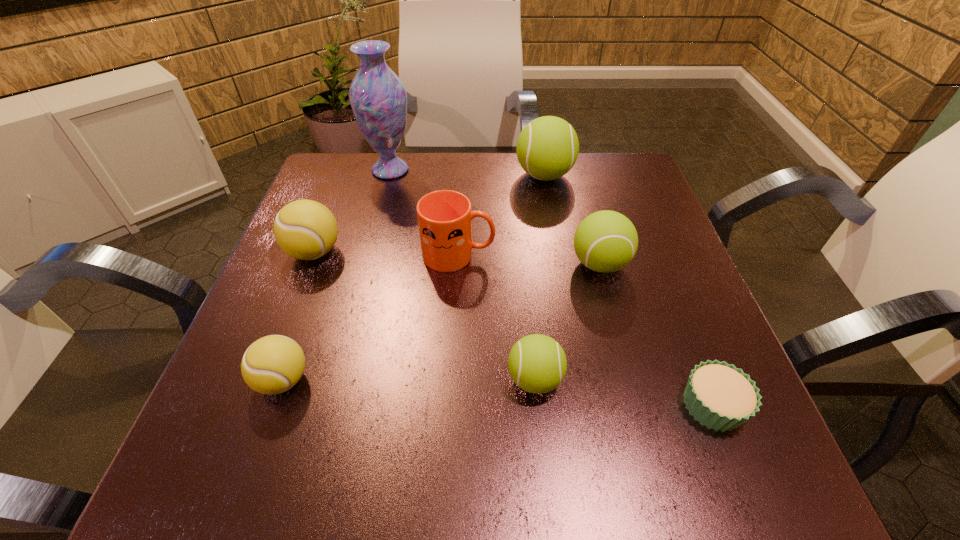
Find the location of `unoccupied area between the nearer yellow tennis ball and the biggest green tennis ball`. unoccupied area between the nearer yellow tennis ball and the biggest green tennis ball is located at coordinates (414, 278).

The image size is (960, 540). I want to click on vacant area that lies between the tallest object and the second smallest green tennis ball, so click(494, 217).

The height and width of the screenshot is (540, 960). I want to click on vacant area between the vase and the smallest green tennis ball, so click(463, 274).

Where is `free space between the nearest green tennis ball and the fourth object from left to right`? The image size is (960, 540). free space between the nearest green tennis ball and the fourth object from left to right is located at coordinates (496, 317).

The image size is (960, 540). In order to click on free area in between the smallest green tennis ball and the second biggest green tennis ball in this screenshot , I will do `click(567, 322)`.

Point out which object is positioned as the seventh nearest to the seventh shortest object. Please provide its 2D coordinates. Your answer should be formatted as a tuple, i.e. [(x, y)], where the tuple contains the x and y coordinates of a point satisfying the conditions above.

[(273, 364)]

The height and width of the screenshot is (540, 960). In order to click on object that is the fifth nearest to the nearer yellow tennis ball in this screenshot , I will do `click(378, 98)`.

I want to click on tennis ball that is the fourth closest to the bigger yellow tennis ball, so click(x=606, y=241).

Select which tennis ball is the closest to the farther yellow tennis ball. Please provide its 2D coordinates. Your answer should be formatted as a tuple, i.e. [(x, y)], where the tuple contains the x and y coordinates of a point satisfying the conditions above.

[(273, 364)]

Select which green tennis ball appears as the third closest to the fourth object from left to right. Please provide its 2D coordinates. Your answer should be formatted as a tuple, i.e. [(x, y)], where the tuple contains the x and y coordinates of a point satisfying the conditions above.

[(537, 363)]